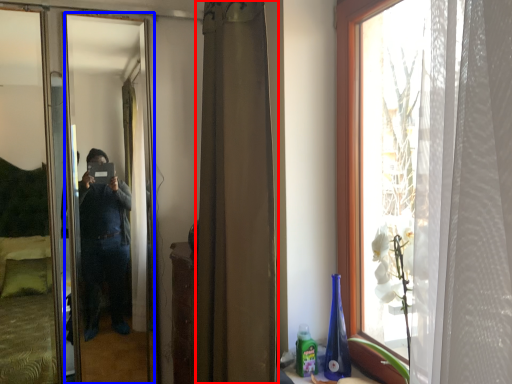
Question: Which point is further to the camera, curtain (highlighted by a red box) or mirror (highlighted by a blue box)?

Choices:
 (A) curtain
 (B) mirror

Answer: (B)